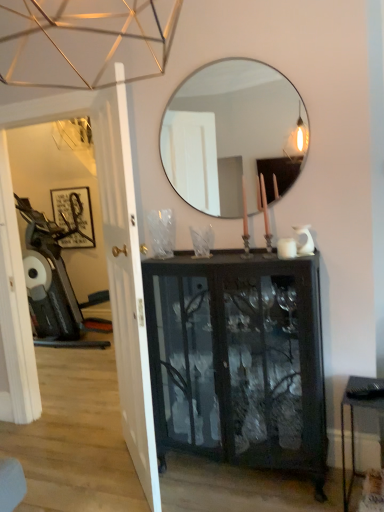
Question: Does white glossy door at left appear on the right side of metallic silver swivel chair at left?

Choices:
 (A) yes
 (B) no

Answer: (A)

Question: Can we say white glossy door at left lies outside metallic silver swivel chair at left?

Choices:
 (A) yes
 (B) no

Answer: (A)

Question: Does white glossy door at left come in front of metallic silver swivel chair at left?

Choices:
 (A) yes
 (B) no

Answer: (A)

Question: From the image's perspective, is white glossy door at left above metallic silver swivel chair at left?

Choices:
 (A) yes
 (B) no

Answer: (B)

Question: Is white glossy door at left positioned far away from metallic silver swivel chair at left?

Choices:
 (A) no
 (B) yes

Answer: (B)

Question: Can you confirm if white glossy door at left is shorter than metallic silver swivel chair at left?

Choices:
 (A) no
 (B) yes

Answer: (A)

Question: Does white glossy door at left have a larger size compared to clear glass mirror at upper center?

Choices:
 (A) no
 (B) yes

Answer: (B)

Question: From the image's perspective, would you say white glossy door at left is shown under clear glass mirror at upper center?

Choices:
 (A) yes
 (B) no

Answer: (A)

Question: Is clear glass mirror at upper center at the back of white glossy door at left?

Choices:
 (A) yes
 (B) no

Answer: (A)

Question: Is white glossy door at left surrounding clear glass mirror at upper center?

Choices:
 (A) yes
 (B) no

Answer: (B)

Question: Is white glossy door at left with clear glass mirror at upper center?

Choices:
 (A) no
 (B) yes

Answer: (A)

Question: From the image's perspective, is white glossy door at left located above clear glass mirror at upper center?

Choices:
 (A) yes
 (B) no

Answer: (B)

Question: Is metallic black table at lower right smaller than black glass cabinet at center?

Choices:
 (A) yes
 (B) no

Answer: (A)